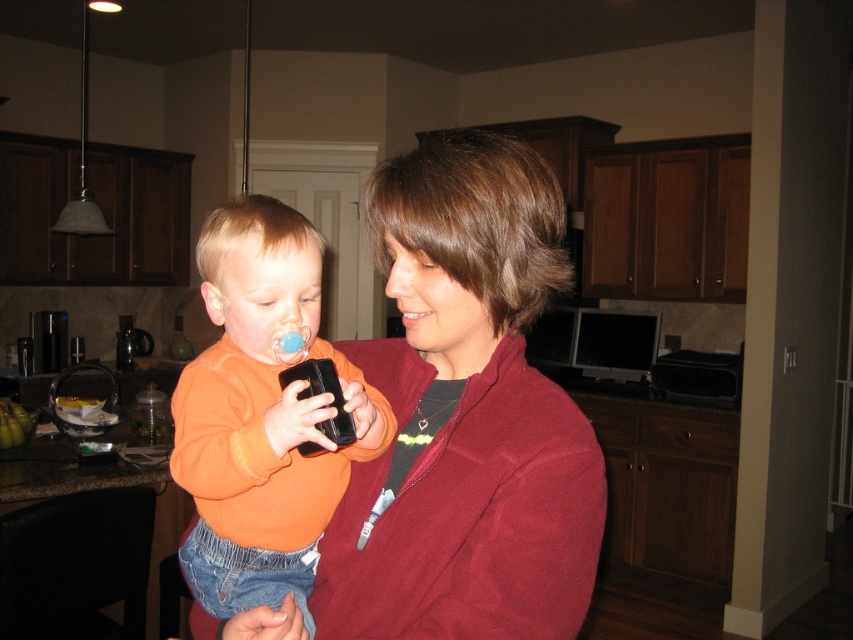
Question: Does maroon fleece jacket at center have a greater width compared to orange matte shirt at center?

Choices:
 (A) no
 (B) yes

Answer: (B)

Question: Which of the following is the farthest from the observer?

Choices:
 (A) orange matte shirt at center
 (B) maroon fleece jacket at center

Answer: (B)

Question: Is maroon fleece jacket at center to the right of orange matte shirt at center from the viewer's perspective?

Choices:
 (A) no
 (B) yes

Answer: (B)

Question: Among these objects, which one is farthest from the camera?

Choices:
 (A) orange matte shirt at center
 (B) maroon fleece jacket at center

Answer: (B)

Question: Which point is closer to the camera?

Choices:
 (A) maroon fleece jacket at center
 (B) orange matte shirt at center

Answer: (B)

Question: Can you confirm if maroon fleece jacket at center is wider than orange matte shirt at center?

Choices:
 (A) no
 (B) yes

Answer: (B)